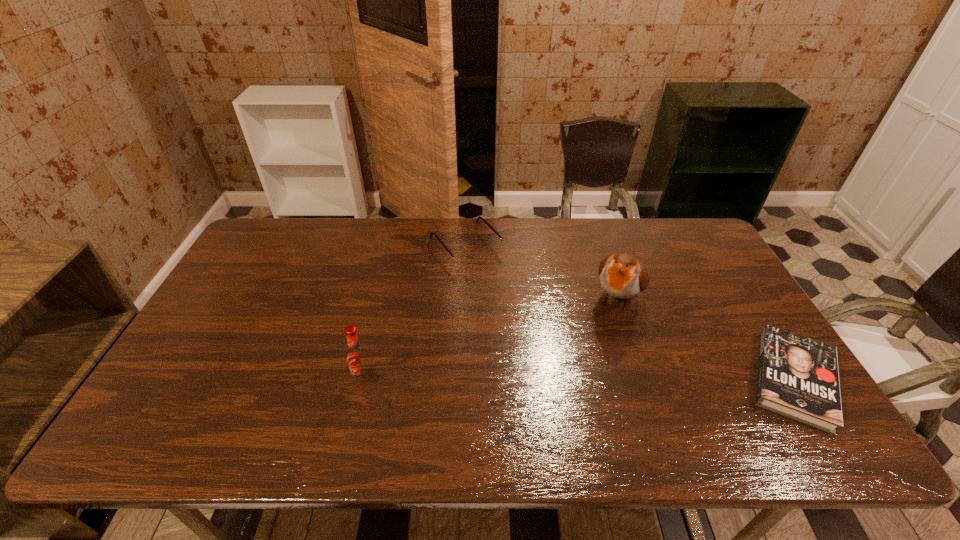
Find the location of a particular element. Image resolution: width=960 pixels, height=540 pixels. unoccupied area between the shortest object and the leftmost object is located at coordinates (579, 380).

Find the location of `free area in between the second farthest object and the leftmost object`. free area in between the second farthest object and the leftmost object is located at coordinates (492, 339).

The image size is (960, 540). What are the coordinates of `free space between the shortest object and the second object from left to right` in the screenshot? It's located at (630, 313).

Find the location of `free space between the bird and the spectacles`. free space between the bird and the spectacles is located at coordinates (542, 272).

In order to click on free point between the leftmost object and the third nearest object in this screenshot , I will do click(x=492, y=339).

The width and height of the screenshot is (960, 540). I want to click on vacant area between the second object from left to right and the bird, so click(542, 272).

Select which object appears as the second closest to the book. Please provide its 2D coordinates. Your answer should be formatted as a tuple, i.e. [(x, y)], where the tuple contains the x and y coordinates of a point satisfying the conditions above.

[(466, 257)]

The width and height of the screenshot is (960, 540). I want to click on object that is the third closest to the spectacles, so click(798, 377).

At what (x,y) coordinates should I click in order to perform the action: click on vacant space that satisfies the following two spatial constraints: 1. on the front side of the rightmost object; 2. on the right side of the second object from right to left. Please return your answer as a coordinate pair (x, y). Looking at the image, I should click on (645, 379).

Find the location of `free space that satisfies the following two spatial constraints: 1. on the front side of the bird; 2. on the left side of the second object from left to right`. free space that satisfies the following two spatial constraints: 1. on the front side of the bird; 2. on the left side of the second object from left to right is located at coordinates (465, 298).